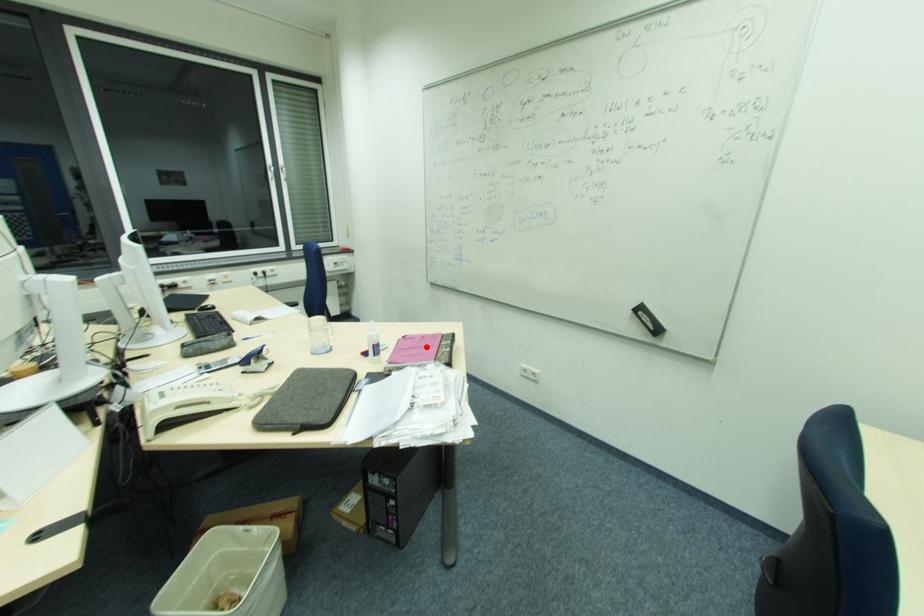
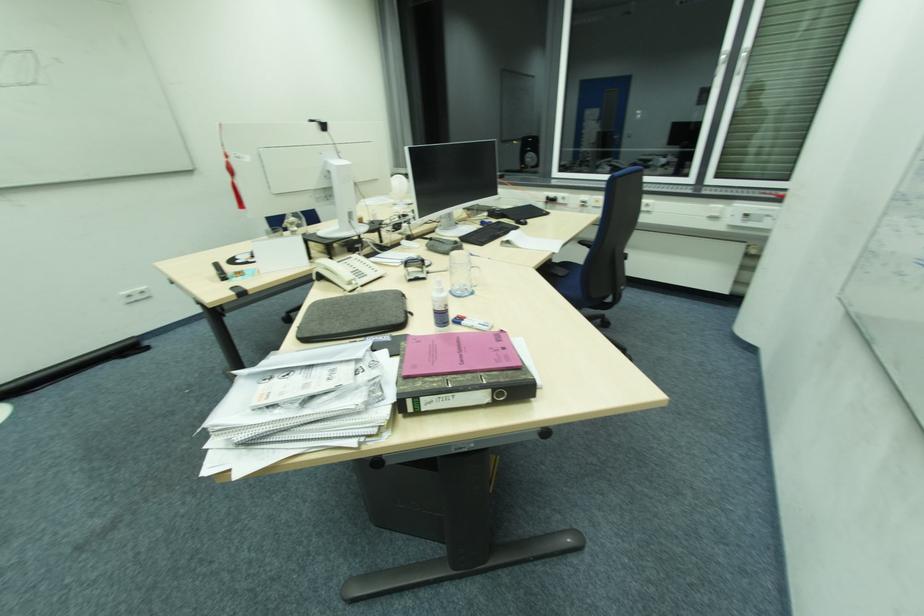
In the second image, find the point that corresponds to the highlighted location in the first image.

(465, 357)